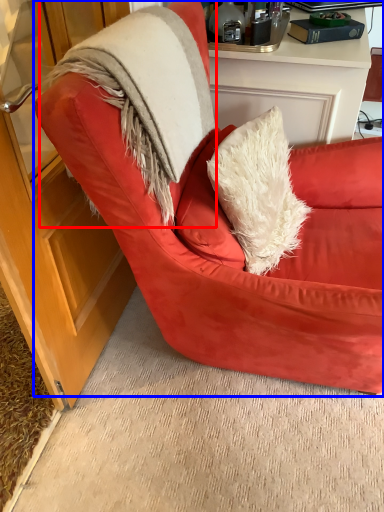
Question: Which object appears closest to the camera in this image, fur coat (highlighted by a red box) or chair (highlighted by a blue box)?

Choices:
 (A) fur coat
 (B) chair

Answer: (B)